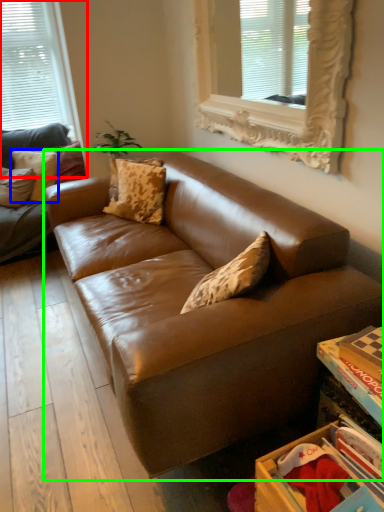
Question: Considering the real-world distances, which object is farthest from window (highlighted by a red box)? pillow (highlighted by a blue box) or studio couch (highlighted by a green box)?

Choices:
 (A) pillow
 (B) studio couch

Answer: (B)